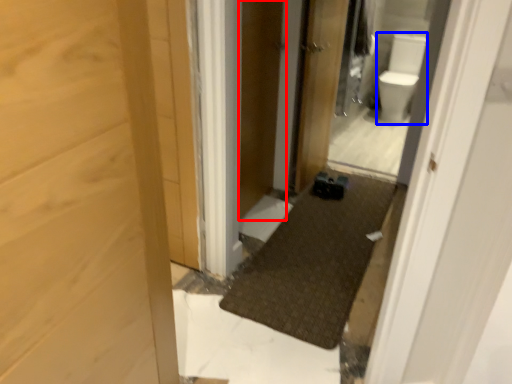
Question: Which object is further to the camera taking this photo, screen door (highlighted by a red box) or toilet bowl (highlighted by a blue box)?

Choices:
 (A) screen door
 (B) toilet bowl

Answer: (B)